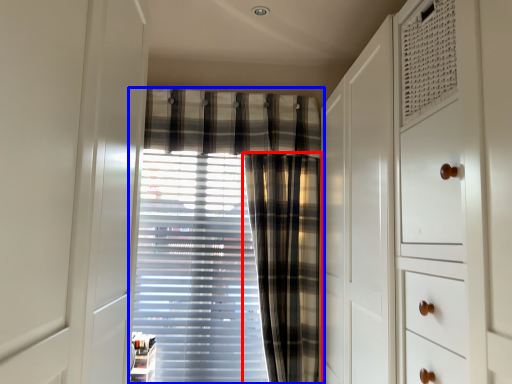
Question: Which object is further to the camera taking this photo, curtain (highlighted by a red box) or curtain (highlighted by a blue box)?

Choices:
 (A) curtain
 (B) curtain

Answer: (B)